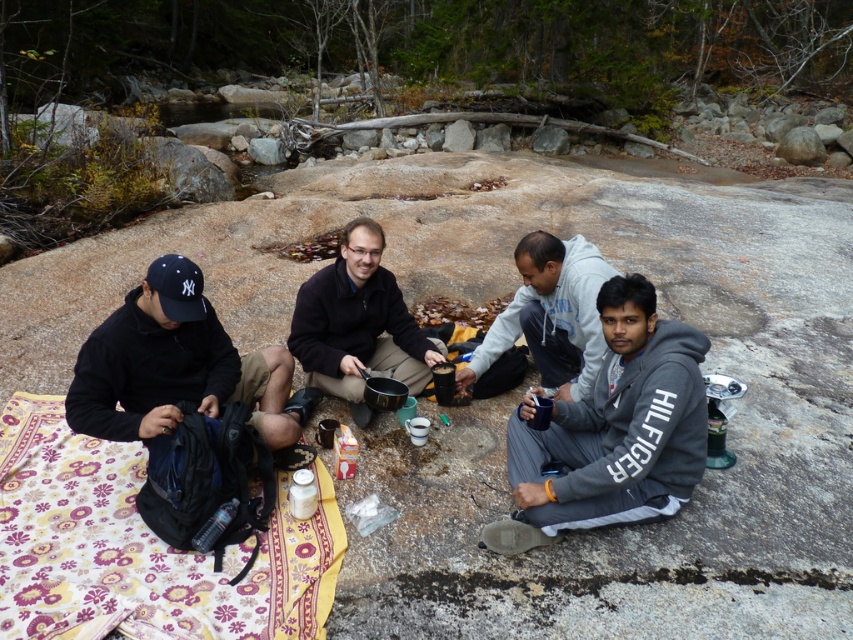
Question: Can you confirm if black matte jacket at lower left is positioned above matte black jacket at center?

Choices:
 (A) yes
 (B) no

Answer: (B)

Question: Is matte black jacket at center behind gray fleece jacket at center?

Choices:
 (A) no
 (B) yes

Answer: (B)

Question: Is the position of gray fleece jacket at lower right more distant than that of gray fleece jacket at center?

Choices:
 (A) no
 (B) yes

Answer: (A)

Question: Based on their relative distances, which object is farther from the black matte jacket at lower left?

Choices:
 (A) matte black jacket at center
 (B) gray fleece jacket at lower right
 (C) patterned fabric blanket at lower left
 (D) gray fleece jacket at center

Answer: (B)

Question: Which point is farther to the camera?

Choices:
 (A) matte black jacket at center
 (B) patterned fabric blanket at lower left
 (C) black matte jacket at lower left
 (D) gray fleece jacket at lower right

Answer: (A)

Question: Which of the following is the farthest from the observer?

Choices:
 (A) (361, 397)
 (B) (161, 305)

Answer: (A)